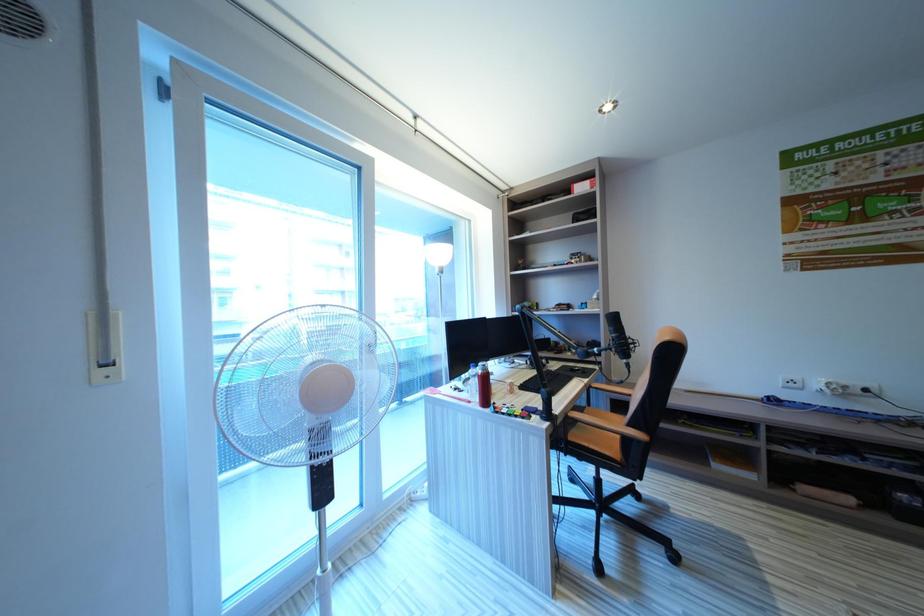
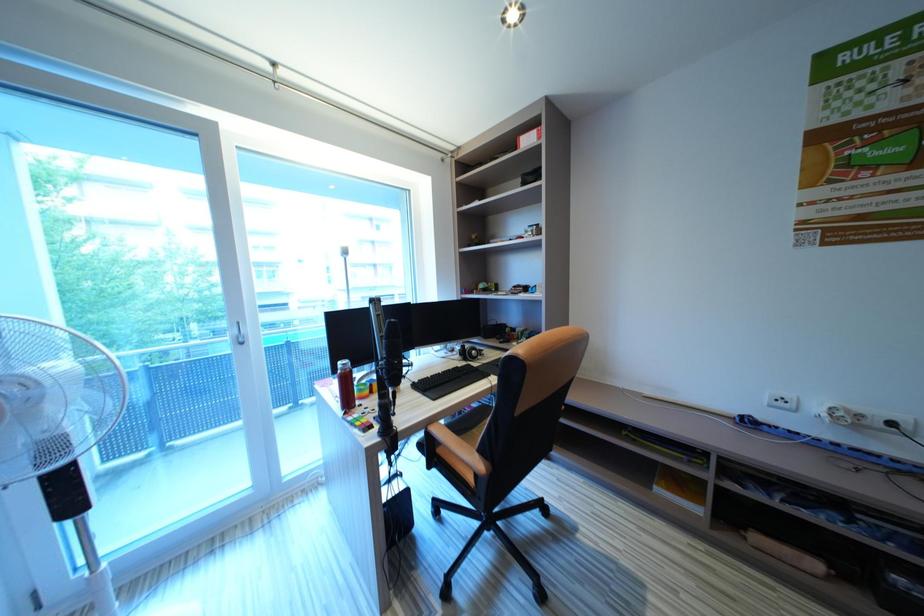
Question: The camera is either moving clockwise (left) or counter-clockwise (right) around the object. The first image is from the beginning of the video and the second image is from the end. Is the camera moving left or right when shooting the video?

Choices:
 (A) Left
 (B) Right

Answer: (B)